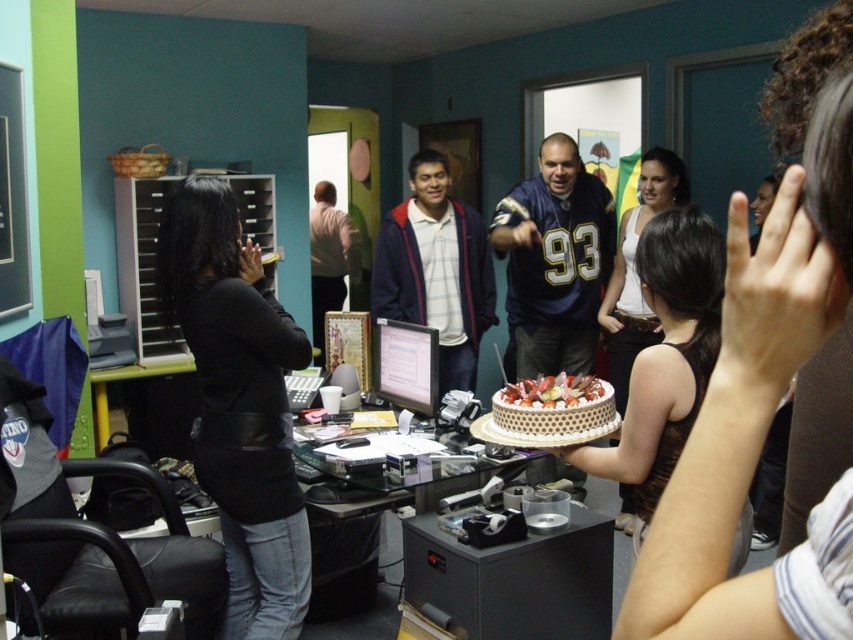
Question: Can you confirm if black leather jacket at left is thinner than blue jersey at center?

Choices:
 (A) yes
 (B) no

Answer: (A)

Question: Which point is closer to the camera?

Choices:
 (A) blue jersey at center
 (B) light brown leather jacket at center

Answer: (A)

Question: Is black leather jacket at left positioned behind white textured cake at center?

Choices:
 (A) no
 (B) yes

Answer: (B)

Question: Is matte blue jacket at center smaller than light brown leather jacket at center?

Choices:
 (A) yes
 (B) no

Answer: (A)

Question: Among these objects, which one is farthest from the camera?

Choices:
 (A) light brown leather jacket at center
 (B) blue jersey at center

Answer: (A)

Question: Which object appears closest to the camera in this image?

Choices:
 (A) white textured cake at center
 (B) light brown leather jacket at center

Answer: (A)